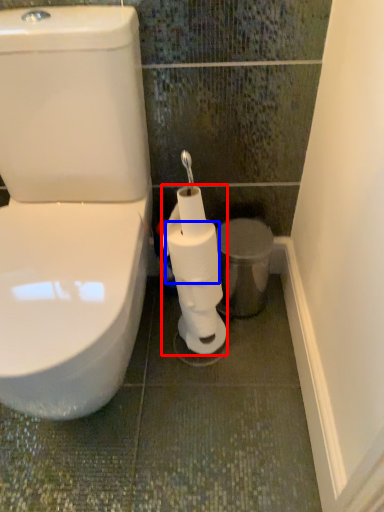
Question: Which object is closer to the camera taking this photo, toilet paper (highlighted by a red box) or toilet paper (highlighted by a blue box)?

Choices:
 (A) toilet paper
 (B) toilet paper

Answer: (A)